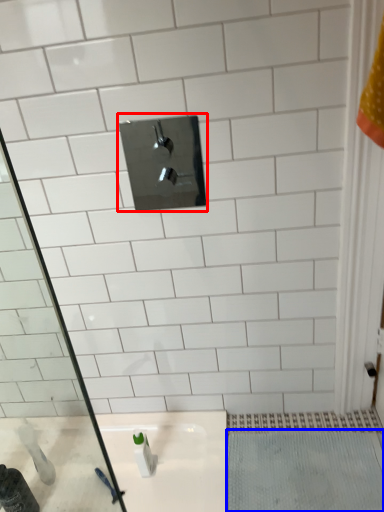
Question: Which object appears farthest to the camera in this image, tap (highlighted by a red box) or bath mat (highlighted by a blue box)?

Choices:
 (A) tap
 (B) bath mat

Answer: (B)